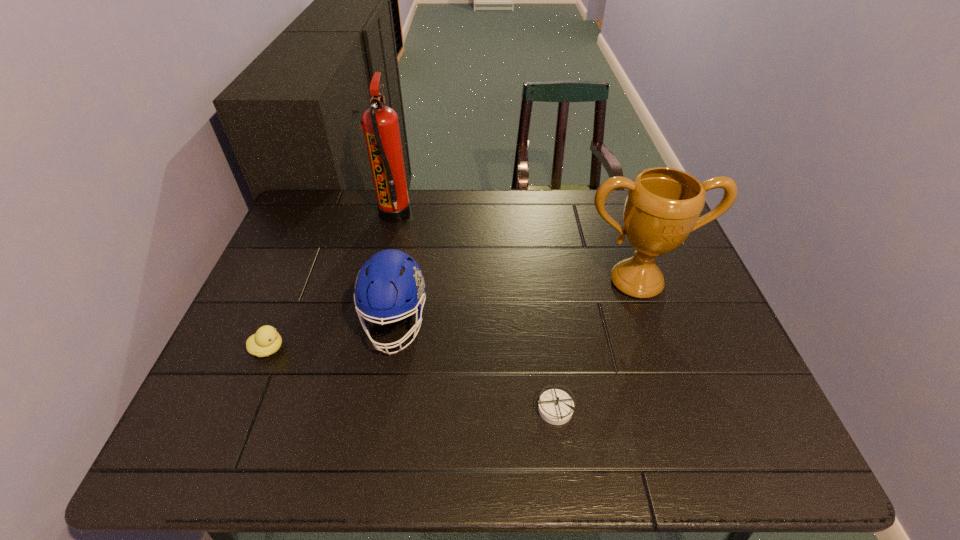
Where is `vacant space that satisfies the following two spatial constraints: 1. on the front of the award with the decoration; 2. at the beak of the duckling`? The height and width of the screenshot is (540, 960). vacant space that satisfies the following two spatial constraints: 1. on the front of the award with the decoration; 2. at the beak of the duckling is located at coordinates (660, 349).

The image size is (960, 540). Find the location of `free space that satisfies the following two spatial constraints: 1. at the beak of the fourth tallest object; 2. on the back side of the nearest object`. free space that satisfies the following two spatial constraints: 1. at the beak of the fourth tallest object; 2. on the back side of the nearest object is located at coordinates (244, 409).

Image resolution: width=960 pixels, height=540 pixels. Identify the location of free location that satisfies the following two spatial constraints: 1. at the beak of the leftmost object; 2. on the back side of the nearest object. (244, 409).